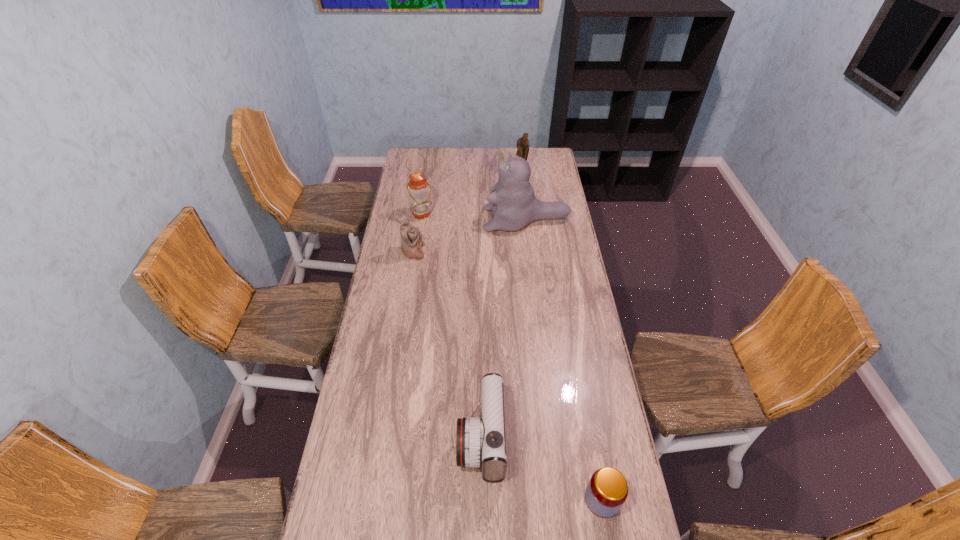
Find the location of `free space that satisfies the following two spatial constraints: 1. on the front-facing side of the jar; 2. on the right side of the farther figurine`. free space that satisfies the following two spatial constraints: 1. on the front-facing side of the jar; 2. on the right side of the farther figurine is located at coordinates (559, 500).